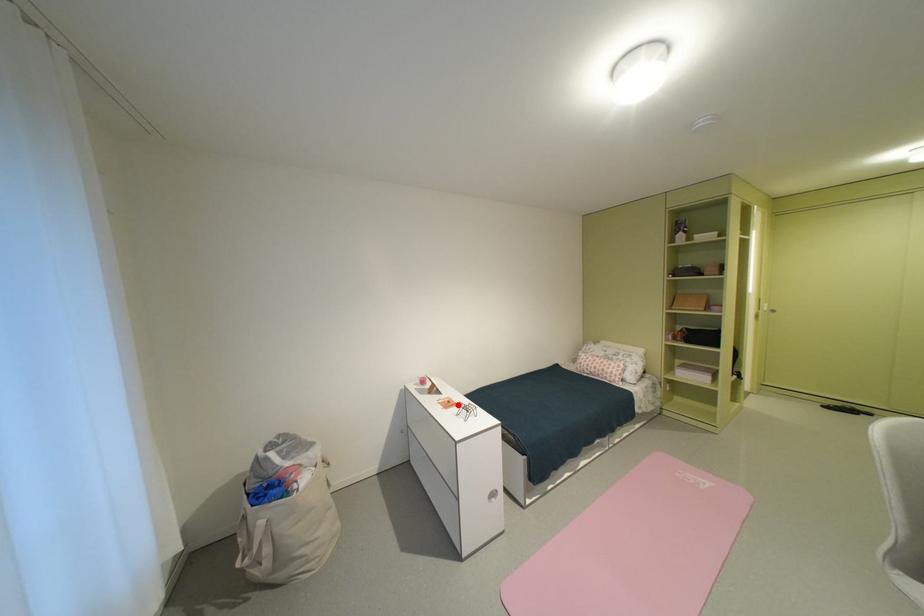
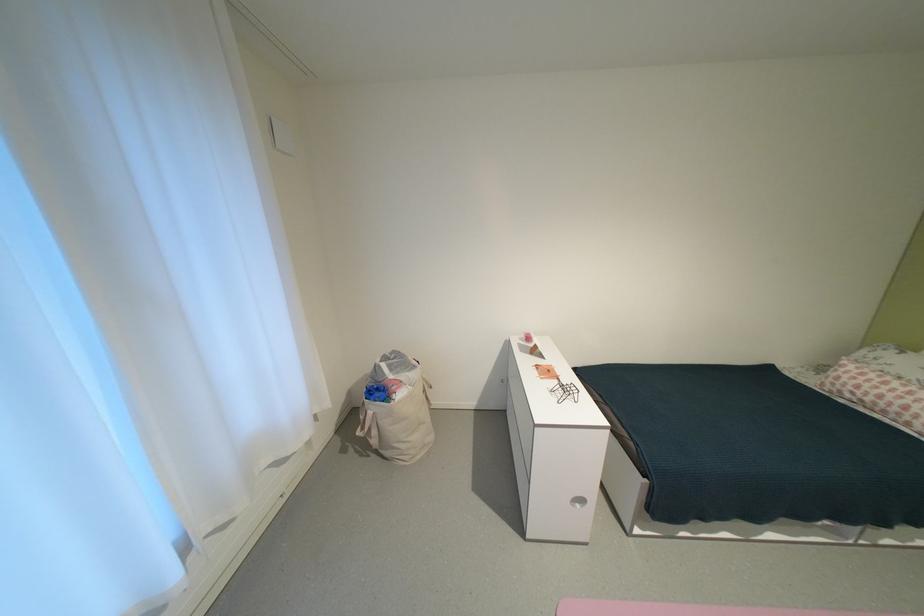
Find the pixel in the second image that matches the highlighted location in the first image.

(556, 374)